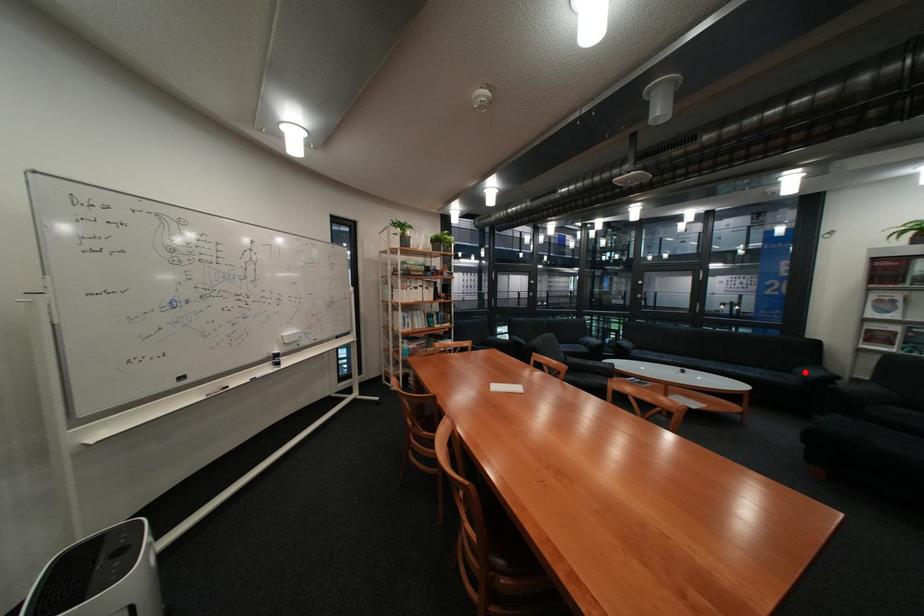
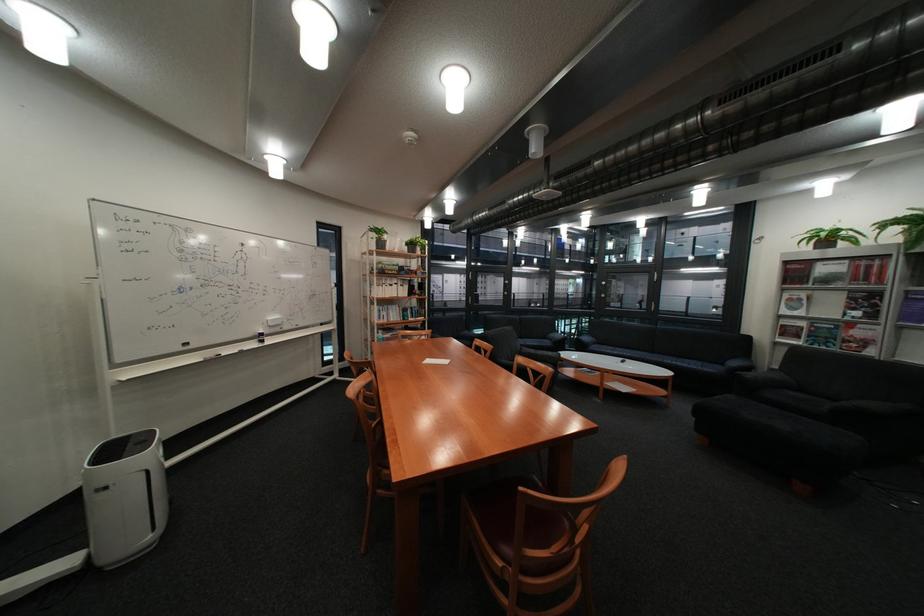
Question: I am providing you with two images of the same scene from different viewpoints. A red point is shown in image1. For the corresponding object point in image2, is it positioned nearer or farther from the camera?

Choices:
 (A) Nearer
 (B) Farther

Answer: (A)